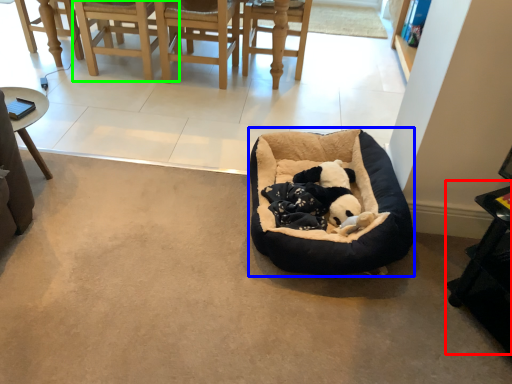
Question: Considering the real-world distances, which object is closest to table (highlighted by a red box)? dog bed (highlighted by a blue box) or chair (highlighted by a green box).

Choices:
 (A) dog bed
 (B) chair

Answer: (A)